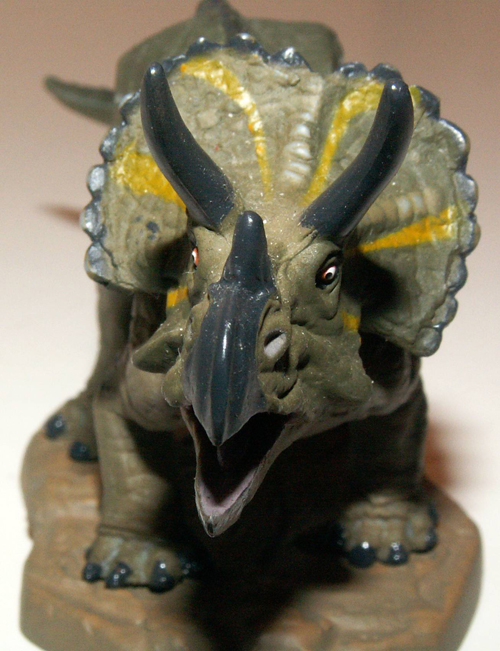
Where is `white surface`? The height and width of the screenshot is (651, 500). white surface is located at coordinates (469, 497).